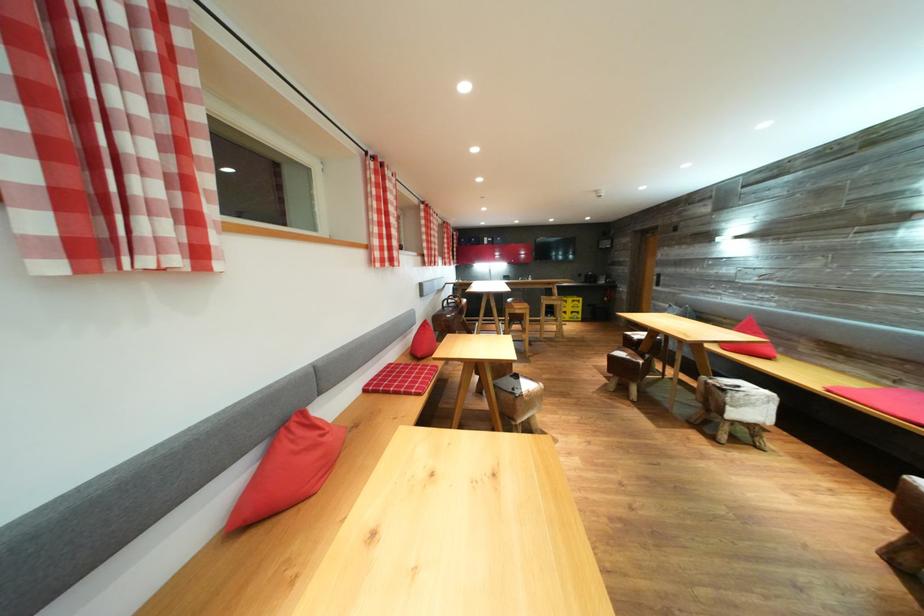
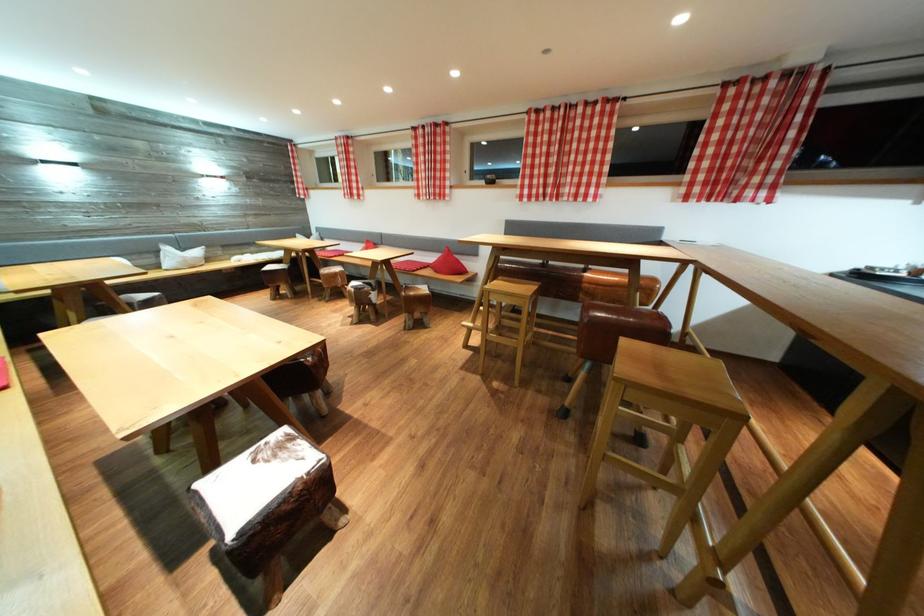
Question: I am providing you with two images of the same scene from different viewpoints. Which of the following objects are not visible in image2?

Choices:
 (A) bar stool sitting surface
 (B) brown leather stool
 (C) cowhide covered stool
 (D) metal pen holder

Answer: (A)